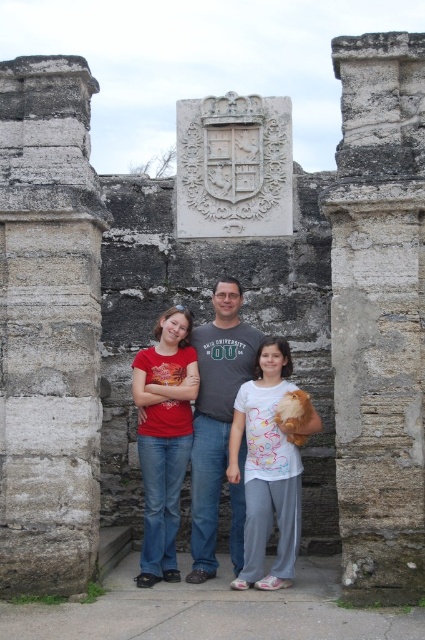
Between gray stone pillar at left and gray stone pillar at center, which one is positioned higher?

gray stone pillar at center is higher up.

Is gray stone pillar at left shorter than gray stone pillar at center?

Indeed, gray stone pillar at left has a lesser height compared to gray stone pillar at center.

What do you see at coordinates (48, 326) in the screenshot? I see `gray stone pillar at left` at bounding box center [48, 326].

Locate an element on the screen. gray stone pillar at left is located at coordinates (48, 326).

Is gray stone pillar at center to the right of white cotton shirt at center from the viewer's perspective?

Correct, you'll find gray stone pillar at center to the right of white cotton shirt at center.

Is point (416, 211) more distant than point (260, 515)?

That is False.

Is point (359, 257) farther from viewer compared to point (285, 353)?

No.

I want to click on gray stone pillar at center, so click(379, 316).

Does white cotton shirt at center have a lesser width compared to matte red t-shirt at center?

Yes, white cotton shirt at center is thinner than matte red t-shirt at center.

Who is lower down, white cotton shirt at center or matte red t-shirt at center?

white cotton shirt at center is lower down.

Image resolution: width=425 pixels, height=640 pixels. Find the location of `white cotton shirt at center`. white cotton shirt at center is located at coordinates (268, 468).

Locate an element on the screen. This screenshot has height=640, width=425. white cotton shirt at center is located at coordinates (268, 468).